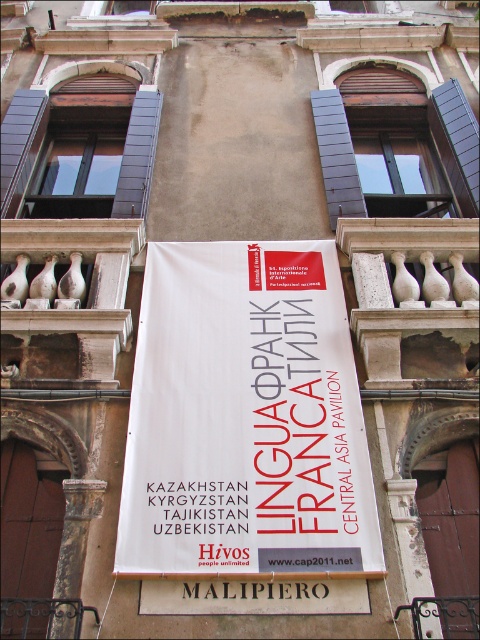
Question: Is white paper banner at center wider than dark brown wood at left?

Choices:
 (A) no
 (B) yes

Answer: (B)

Question: Is white stone balustrade at center thinner than blue painted wood shutter at upper right?

Choices:
 (A) yes
 (B) no

Answer: (B)

Question: Does white paper banner at center have a larger size compared to dark gray wood shutter at upper center?

Choices:
 (A) yes
 (B) no

Answer: (A)

Question: Which object is the closest to the white stone balustrade at center?

Choices:
 (A) white paper banner at center
 (B) dark gray wood shutter at upper left
 (C) dark gray wood shutter at upper center
 (D) blue painted wood shutter at upper right

Answer: (A)

Question: Which point is farther from the camera taking this photo?

Choices:
 (A) (356, 204)
 (B) (457, 196)
 (C) (80, 282)

Answer: (B)

Question: Which point is closer to the camera?

Choices:
 (A) white matte sign at center
 (B) dark gray wood shutter at upper center
 (C) dark gray wood shutter at upper left

Answer: (A)